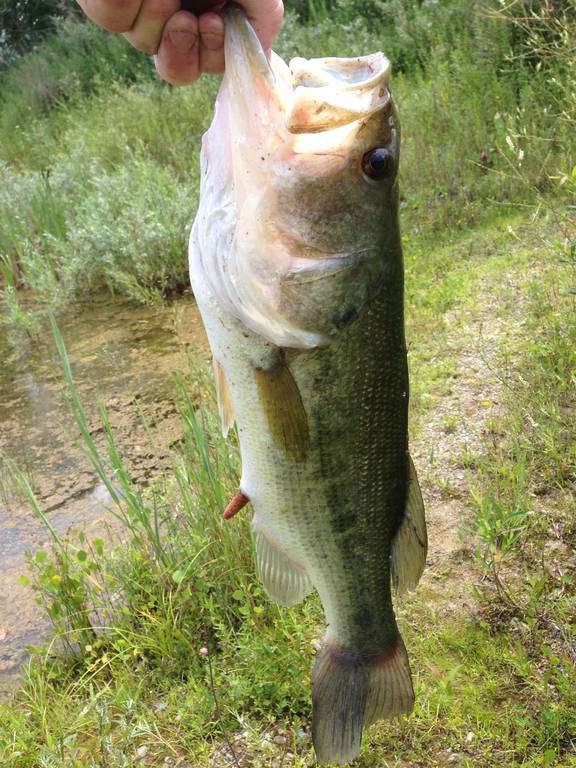
Where is `scales`? scales is located at coordinates (354, 419).